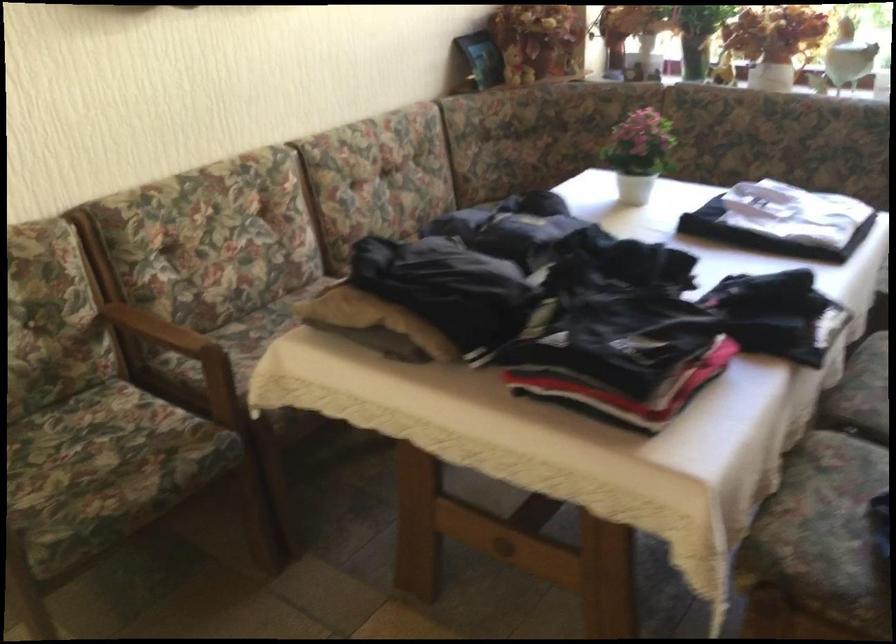
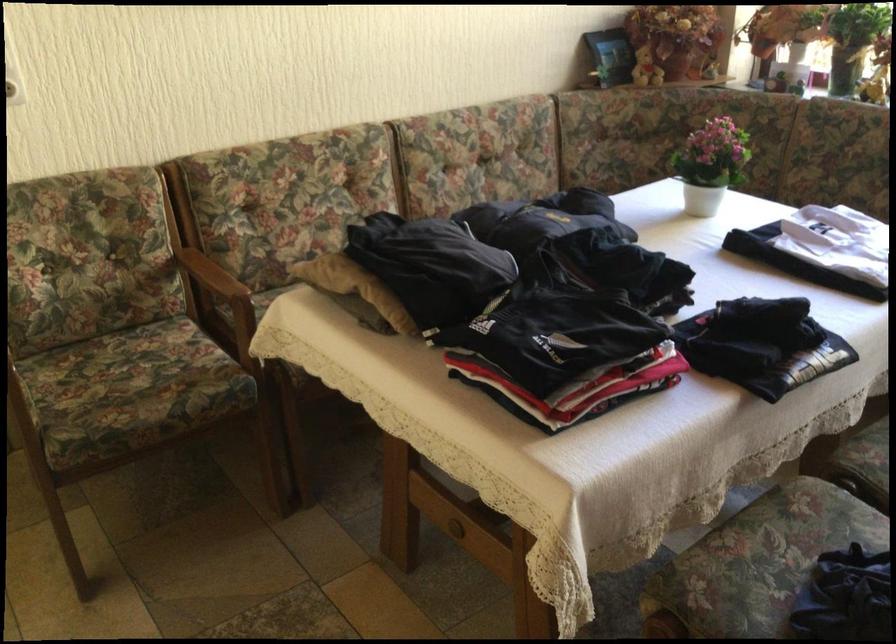
Find the pixel in the second image that matches [643,152] in the first image.

(711, 164)